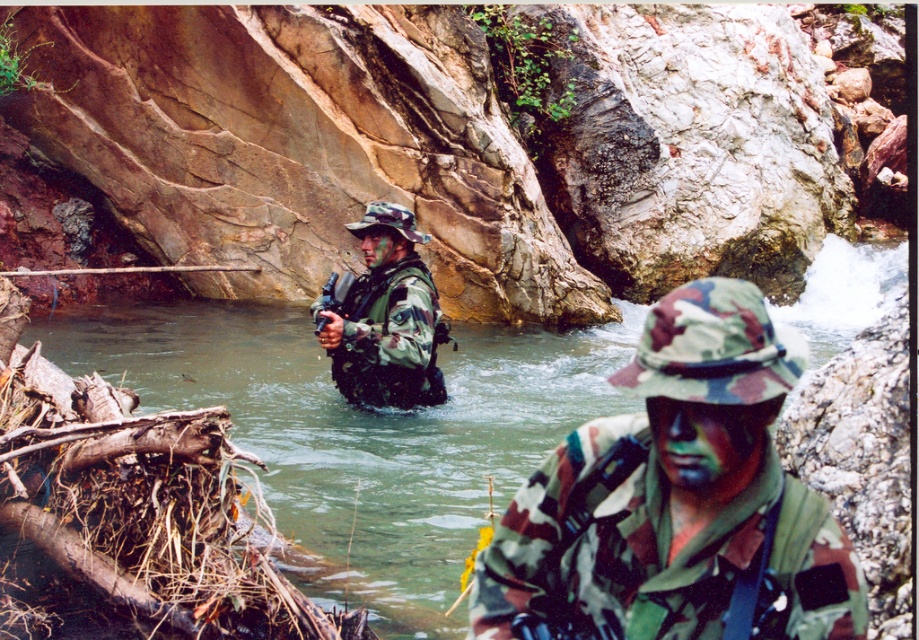
You are a soldier in the field and need to retrieve your camouflage fabric helmet at center. You are currently standing on the rocky bank. Which direction should you move to reach it first, considering the greenish water at creek center is between you and the helmet?

The camouflage fabric helmet at center is behind the greenish water at creek center because the water is closer to you. To reach the helmet, you must first move through or around the greenish water at creek center.

You are a military trainee who needs to carry both the camouflage fabric helmet at center and the matte black rifle at center. Which object should you pick up first if you want to carry the larger item first?

The camouflage fabric helmet at center is bigger than the matte black rifle at center, so you should pick up the camouflage fabric helmet at center first.

You are a military observer in the field. You need to determine which object is smaller between the camo fabric uniform at center and the greenish water at creek center. Which one is smaller?

The camo fabric uniform at center is smaller compared to the greenish water at creek center, so the smaller object is the camo fabric uniform at center.